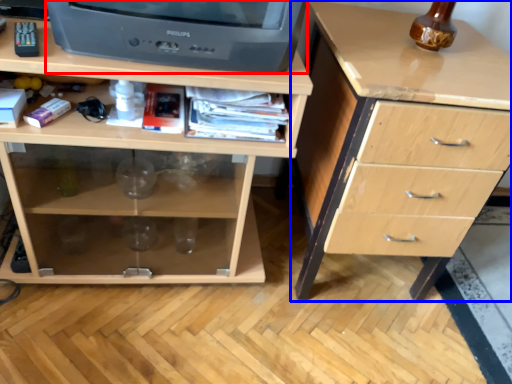
Question: Which object appears farthest to the camera in this image, television (highlighted by a red box) or chest of drawers (highlighted by a blue box)?

Choices:
 (A) television
 (B) chest of drawers

Answer: (B)